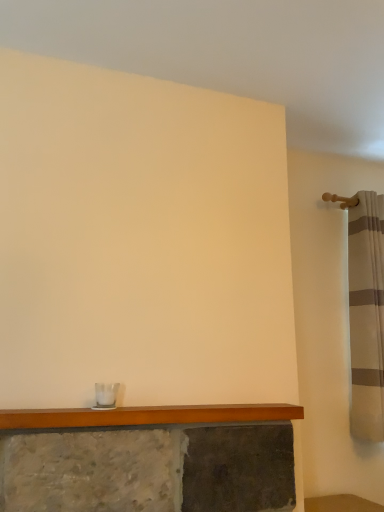
Question: Does wooden mantle at lower center have a lesser width compared to striped fabric shower curtain at right?

Choices:
 (A) no
 (B) yes

Answer: (B)

Question: Are wooden mantle at lower center and striped fabric shower curtain at right beside each other?

Choices:
 (A) yes
 (B) no

Answer: (B)

Question: Is wooden mantle at lower center in front of striped fabric shower curtain at right?

Choices:
 (A) yes
 (B) no

Answer: (A)

Question: Can you confirm if wooden mantle at lower center is wider than striped fabric shower curtain at right?

Choices:
 (A) yes
 (B) no

Answer: (B)

Question: Does wooden mantle at lower center appear on the right side of striped fabric shower curtain at right?

Choices:
 (A) no
 (B) yes

Answer: (A)

Question: Can you confirm if wooden mantle at lower center is shorter than striped fabric shower curtain at right?

Choices:
 (A) yes
 (B) no

Answer: (A)

Question: From the image's perspective, is striped fabric shower curtain at right on wooden mantle at lower center?

Choices:
 (A) no
 (B) yes

Answer: (B)

Question: Does striped fabric shower curtain at right turn towards wooden mantle at lower center?

Choices:
 (A) yes
 (B) no

Answer: (B)

Question: Are striped fabric shower curtain at right and wooden mantle at lower center beside each other?

Choices:
 (A) yes
 (B) no

Answer: (B)

Question: Is the depth of striped fabric shower curtain at right greater than that of wooden mantle at lower center?

Choices:
 (A) yes
 (B) no

Answer: (A)

Question: Are striped fabric shower curtain at right and wooden mantle at lower center located far from each other?

Choices:
 (A) yes
 (B) no

Answer: (B)

Question: Can you confirm if striped fabric shower curtain at right is positioned to the left of wooden mantle at lower center?

Choices:
 (A) yes
 (B) no

Answer: (B)

Question: Considering the positions of point (367, 372) and point (253, 411), is point (367, 372) closer or farther from the camera than point (253, 411)?

Choices:
 (A) farther
 (B) closer

Answer: (A)